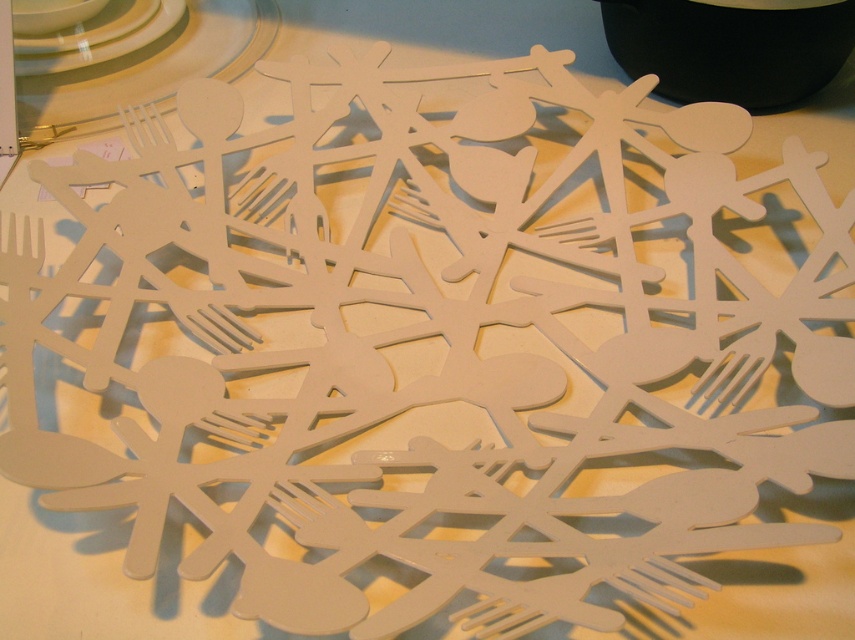
You are organizing a small party and need to decide where to place the black matte bottle at upper right and the matte white plastic fork at upper left. Considering their sizes, which object should be placed in a narrower space?

The black matte bottle at upper right is thinner than the matte white plastic fork at upper left, so it should be placed in the narrower space.

You are arranging a dinner setting and need to place the black matte bottle at upper right and the white glossy plate at upper left. According to the scene, which object is closer to the viewer?

The white glossy plate at upper left is closer to the viewer because the black matte bottle at upper right is positioned under it.

You are an artist arranging paper cutouts on a table. You have a matte white plastic fork at upper left. Where exactly should you place it to match the existing arrangement?

The matte white plastic fork at upper left should be placed at the 2D coordinates point (146, 68) to match the existing arrangement.